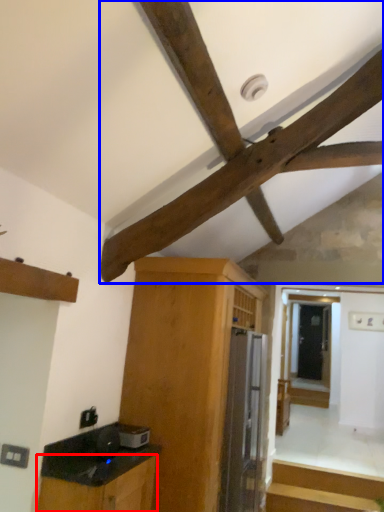
Question: Among these objects, which one is nearest to the camera, cabinetry (highlighted by a red box) or exhaust hood (highlighted by a blue box)?

Choices:
 (A) cabinetry
 (B) exhaust hood

Answer: (A)